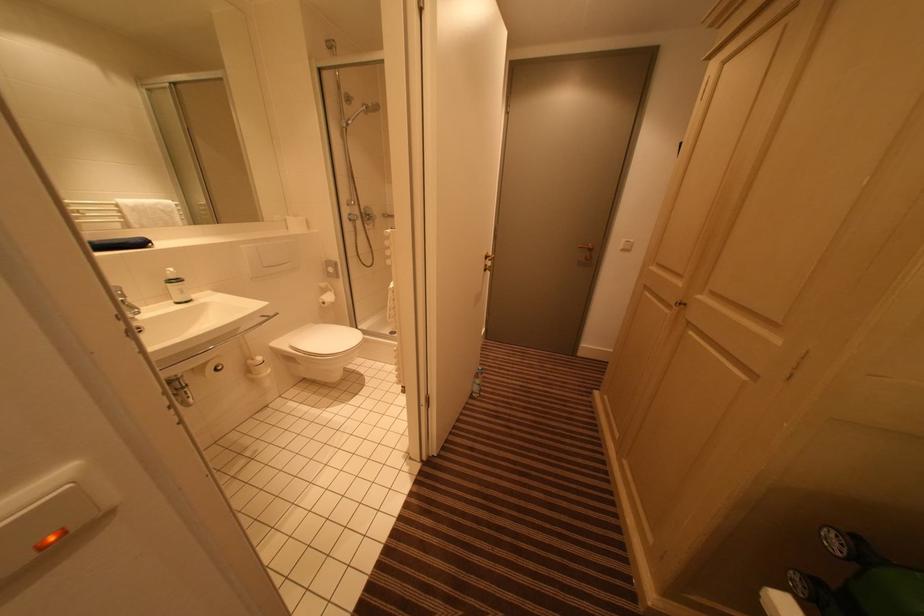
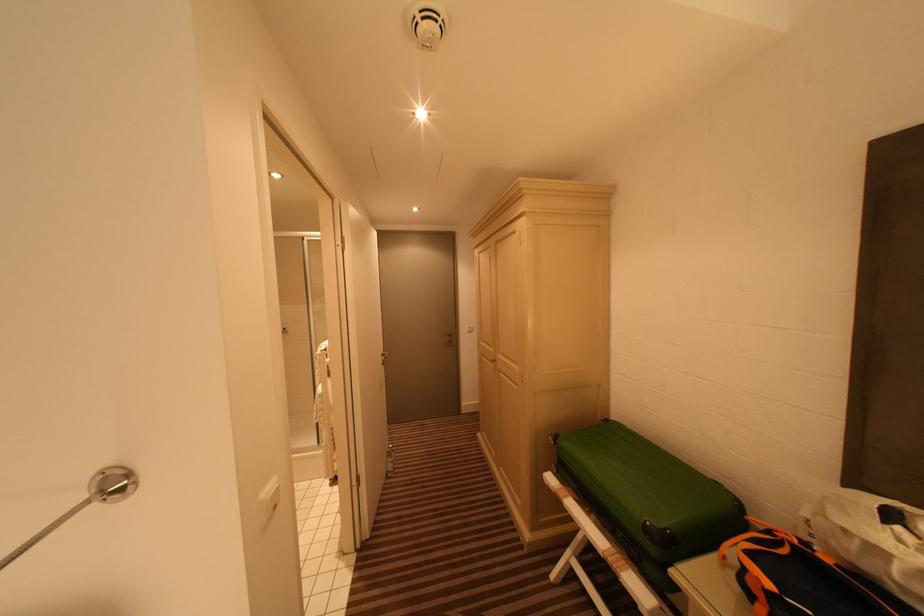
The point at (869,553) is marked in the first image. Where is the corresponding point in the second image?

(563, 440)